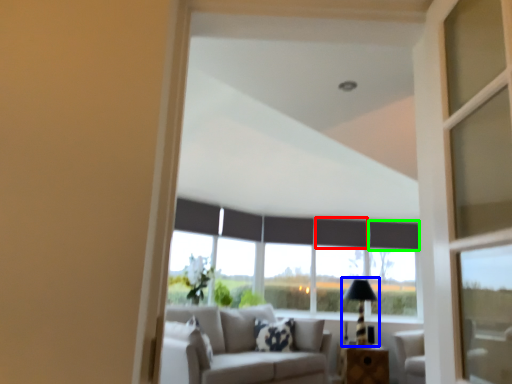
Question: Based on their relative distances, which object is farther from curtain (highlighted by a red box)? Choose from table lamp (highlighted by a blue box) and curtain (highlighted by a green box).

Choices:
 (A) table lamp
 (B) curtain

Answer: (A)